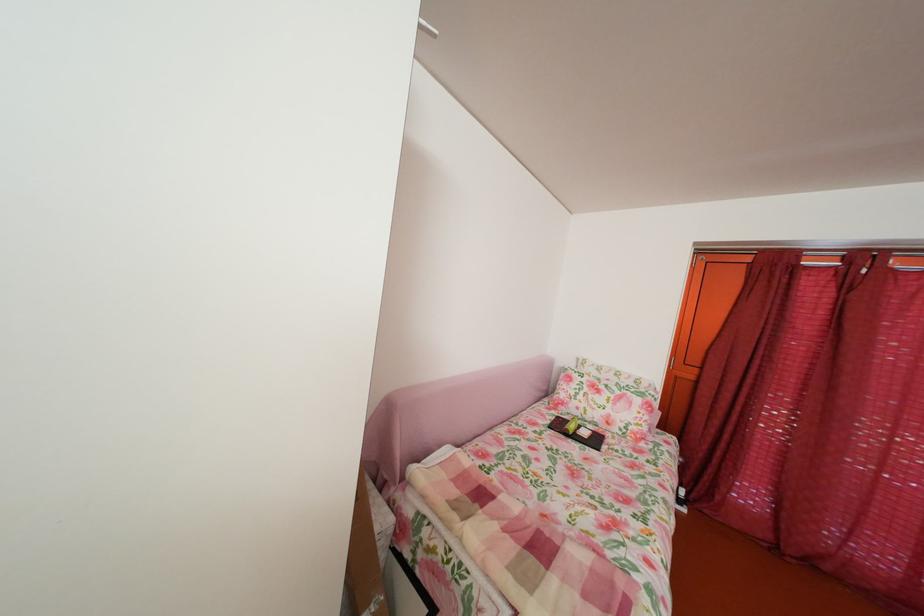
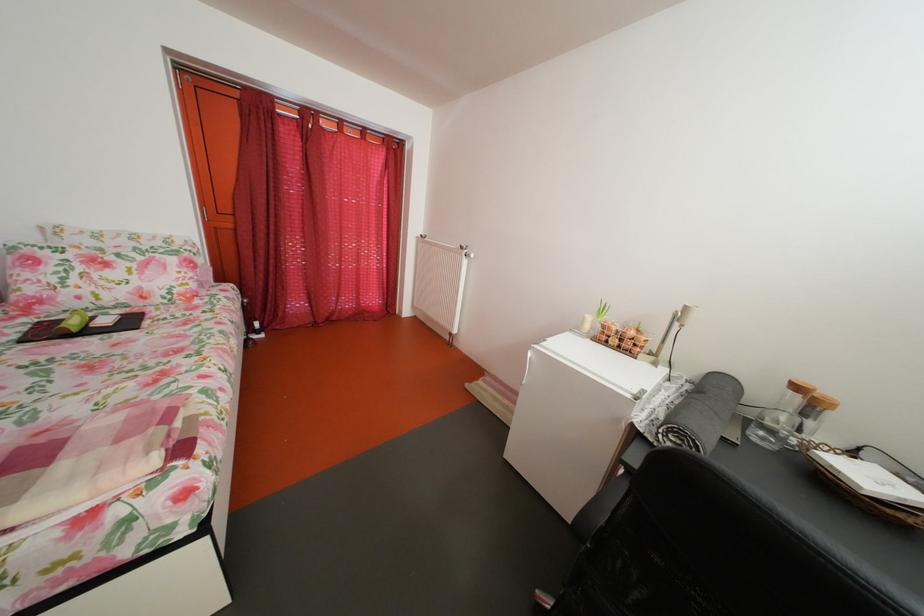
The point at [578,428] is marked in the first image. Where is the corresponding point in the second image?

(73, 326)